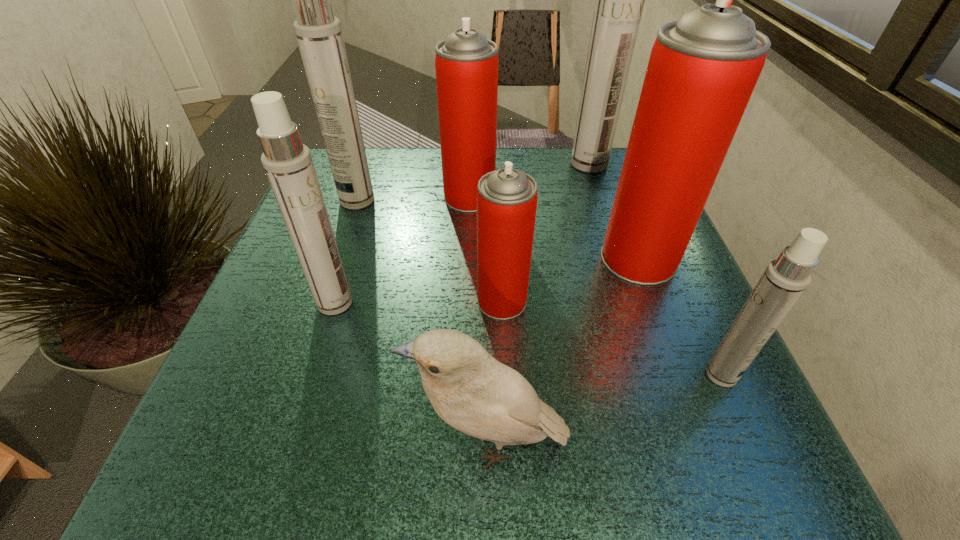
Where is `free space between the second smallest red aerosol can and the biggest red aerosol can`? The width and height of the screenshot is (960, 540). free space between the second smallest red aerosol can and the biggest red aerosol can is located at coordinates (554, 228).

At what (x,y) coordinates should I click in order to perform the action: click on unoccupied area between the second smallest red aerosol can and the second farthest white aerosol can. Please return your answer as a coordinate pair (x, y). Looking at the image, I should click on (414, 199).

Identify the location of empty space between the third farthest white aerosol can and the tallest aerosol can. The width and height of the screenshot is (960, 540). (462, 233).

This screenshot has width=960, height=540. What are the coordinates of `free space between the second biggest white aerosol can and the second nearest white aerosol can` in the screenshot? It's located at (347, 252).

Image resolution: width=960 pixels, height=540 pixels. I want to click on blank region between the second biggest white aerosol can and the seventh farthest object, so click(x=540, y=287).

Where is `free point between the second farthest white aerosol can and the smallest red aerosol can`? This screenshot has width=960, height=540. free point between the second farthest white aerosol can and the smallest red aerosol can is located at coordinates (430, 251).

Identify which object is the seventh closest to the second smallest white aerosol can. Please provide its 2D coordinates. Your answer should be formatted as a tuple, i.e. [(x, y)], where the tuple contains the x and y coordinates of a point satisfying the conditions above.

[(620, 0)]

At what (x,y) coordinates should I click in order to perform the action: click on the second closest object relative to the rightmost white aerosol can. Please return your answer as a coordinate pair (x, y). Looking at the image, I should click on (470, 390).

Where is `aerosol can that can be found as the fourth closest to the biggest red aerosol can`? This screenshot has width=960, height=540. aerosol can that can be found as the fourth closest to the biggest red aerosol can is located at coordinates (620, 0).

Choose which aerosol can is the third nearest neighbor to the smallest red aerosol can. Please provide its 2D coordinates. Your answer should be formatted as a tuple, i.e. [(x, y)], where the tuple contains the x and y coordinates of a point satisfying the conditions above.

[(288, 164)]